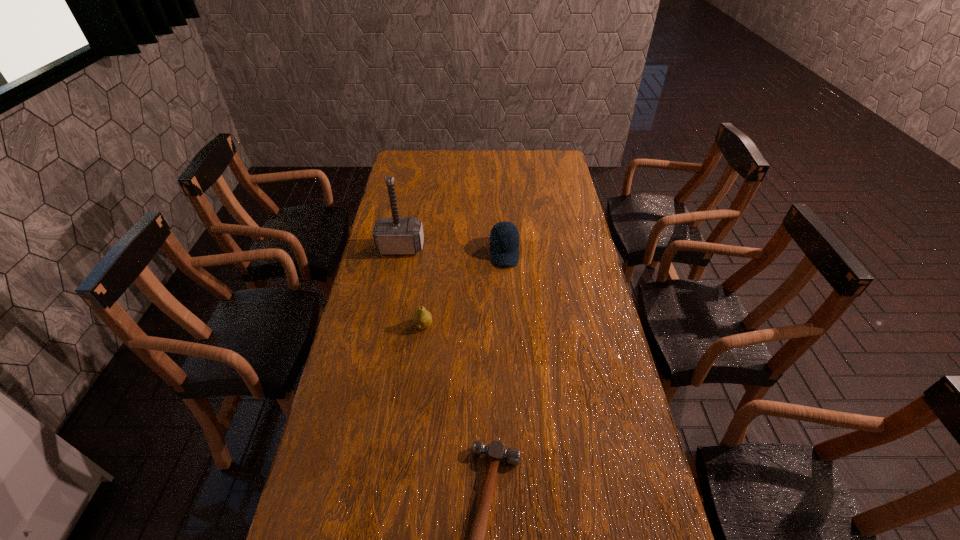
Find the location of a particular element. blank space that satisfies the following two spatial constraints: 1. for striking with the head of the third object from right to left; 2. on the left side of the farther hammer is located at coordinates (385, 326).

The height and width of the screenshot is (540, 960). What are the coordinates of `vacant space that satisfies the following two spatial constraints: 1. for striking with the head of the leftmost object; 2. on the right side of the pear` in the screenshot? It's located at (385, 326).